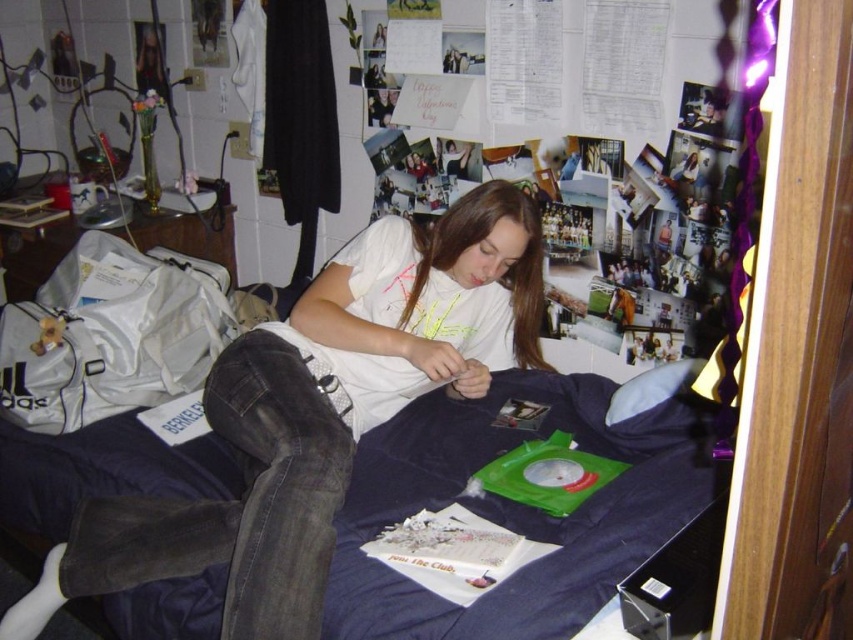
Question: Does white matte t-shirt at center appear under navy blue fabric at center?

Choices:
 (A) no
 (B) yes

Answer: (A)

Question: Which point appears closest to the camera in this image?

Choices:
 (A) (524, 522)
 (B) (224, 371)

Answer: (A)

Question: From the image, what is the correct spatial relationship of white matte t-shirt at center in relation to navy blue fabric at center?

Choices:
 (A) right
 (B) left

Answer: (A)

Question: Which point is closer to the camera?

Choices:
 (A) click(x=477, y=419)
 (B) click(x=265, y=611)

Answer: (B)

Question: Is white matte t-shirt at center further to the viewer compared to navy blue fabric at center?

Choices:
 (A) no
 (B) yes

Answer: (B)